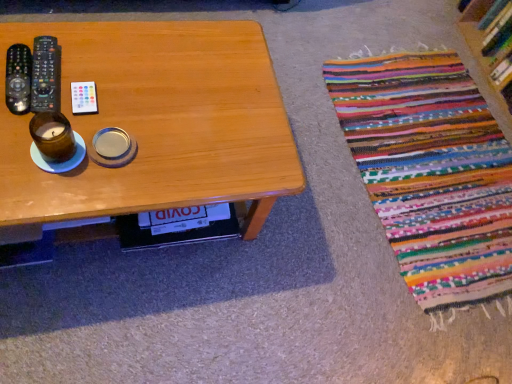
Find the location of a particular element. Image resolution: width=512 pixels, height=384 pixels. empty space that is ontop of wooden table at center is located at coordinates (131, 103).